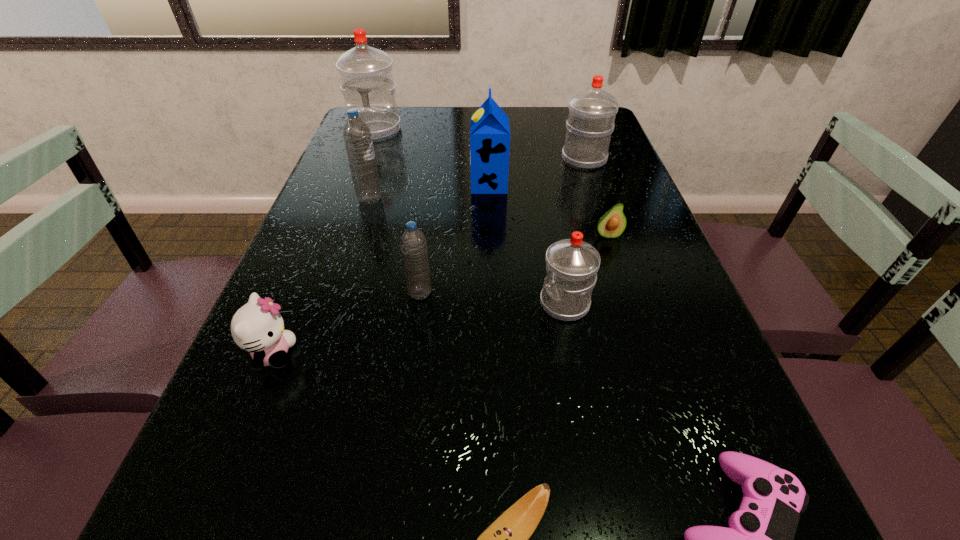
You are a GUI agent. You are given a task and a screenshot of the screen. Output one action in this format:
    pyautogui.click(x=<x>, y=<y>)
    Task: Click on the vacant space that's between the fourth water bottle from left to right and the kitten
    
    Given the screenshot: What is the action you would take?
    pyautogui.click(x=419, y=329)

Locate an element on the screen. This screenshot has height=540, width=960. free spot between the kitten and the farthest white water bottle is located at coordinates (324, 242).

Locate an element on the screen. This screenshot has width=960, height=540. vacant space that is in between the third farthest water bottle and the sixth nearest object is located at coordinates pos(489,217).

Where is `free spot between the nearer blue water bottle and the blue carton`? free spot between the nearer blue water bottle and the blue carton is located at coordinates (454, 239).

Where is `the second closest object to the tallest object`? The width and height of the screenshot is (960, 540). the second closest object to the tallest object is located at coordinates (489, 129).

I want to click on object that is the fifth nearest to the second nearest white water bottle, so click(x=357, y=137).

Choose which water bottle is the fourth nearest neighbor to the tallest water bottle. Please provide its 2D coordinates. Your answer should be formatted as a tuple, i.e. [(x, y)], where the tuple contains the x and y coordinates of a point satisfying the conditions above.

[(572, 264)]

Identify the location of water bottle identified as the closest to the smallest white water bottle. coord(413,243).

This screenshot has height=540, width=960. In order to click on white water bottle identified as the second closest to the nearer blue water bottle in this screenshot , I will do `click(591, 117)`.

Image resolution: width=960 pixels, height=540 pixels. Find the location of `the closest white water bottle to the rightmost white water bottle`. the closest white water bottle to the rightmost white water bottle is located at coordinates (572, 264).